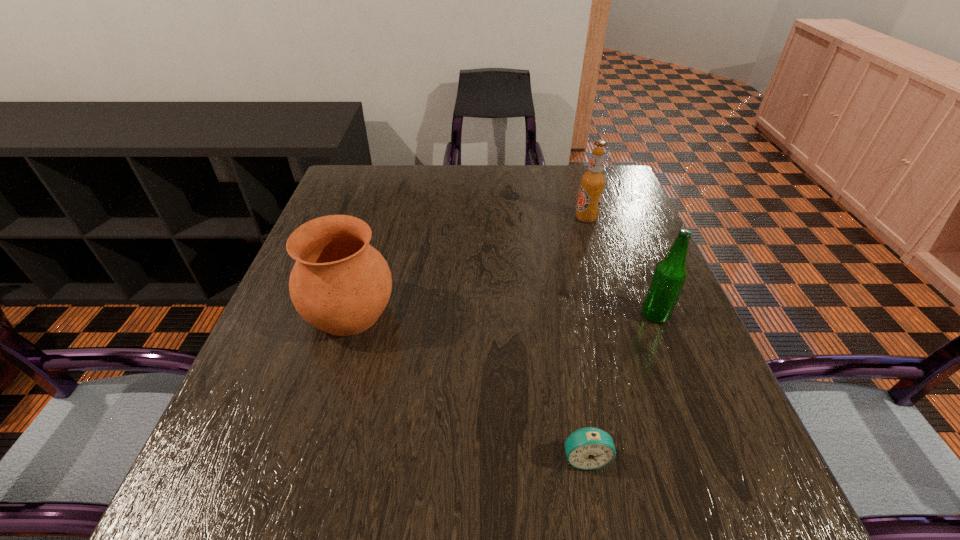
Locate an element on the screen. the farther beer bottle is located at coordinates (592, 183).

Image resolution: width=960 pixels, height=540 pixels. Identify the location of the left beer bottle. point(592,183).

You are a GUI agent. You are given a task and a screenshot of the screen. Output one action in this format:
    pyautogui.click(x=<x>, y=<y>)
    Task: Click on the rightmost object
    This screenshot has width=960, height=540.
    Given the screenshot: What is the action you would take?
    pyautogui.click(x=669, y=276)

You are a GUI agent. You are given a task and a screenshot of the screen. Output one action in this format:
    pyautogui.click(x=<x>, y=<y>)
    Task: Click on the right beer bottle
    This screenshot has width=960, height=540.
    Given the screenshot: What is the action you would take?
    pyautogui.click(x=669, y=276)

This screenshot has width=960, height=540. What are the coordinates of `pottery` in the screenshot? It's located at (340, 284).

Identify the location of the shortest object. The height and width of the screenshot is (540, 960). (588, 448).

Locate an element on the screen. The width and height of the screenshot is (960, 540). alarm clock is located at coordinates (588, 448).

I want to click on vacant position located on the front label of the farthest object, so click(x=483, y=218).

I want to click on free location located on the front label of the farthest object, so click(x=428, y=218).

Identify the location of free region located 0.090m on the front label of the farthest object. (541, 218).